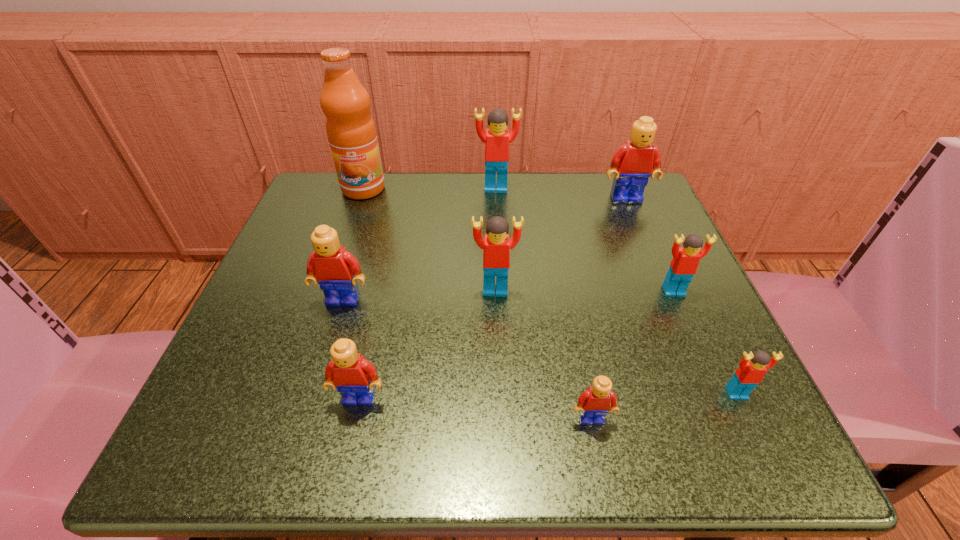
At what (x,y) coordinates should I click in order to perform the action: click on free spot between the tallest object and the smallest red Lego. Please return your answer as a coordinate pair (x, y). This screenshot has height=540, width=960. Looking at the image, I should click on (550, 291).

Where is `free space that is in between the fourth Lego from right to left and the biggest yellow Lego`? The height and width of the screenshot is (540, 960). free space that is in between the fourth Lego from right to left and the biggest yellow Lego is located at coordinates (609, 308).

Locate an element on the screen. Image resolution: width=960 pixels, height=540 pixels. vacant region between the fifth Lego from left to right and the third smallest red Lego is located at coordinates (543, 354).

The image size is (960, 540). In order to click on empty space that is in between the biggest red Lego and the tallest object in this screenshot , I will do `click(430, 188)`.

In order to click on vacant space that is in between the sixth object from left to right and the third farthest yellow Lego in this screenshot , I will do `click(476, 408)`.

Identify the location of vacant point located between the rightmost yellow Lego and the second biggest red Lego. point(561,244).

At what (x,y) coordinates should I click in order to perform the action: click on free spot between the sixth object from left to right and the farthest red Lego. Please return your answer as a coordinate pair (x, y). The height and width of the screenshot is (540, 960). Looking at the image, I should click on (543, 303).

Locate an element on the screen. The image size is (960, 540). free space between the third biggest red Lego and the second smallest yellow Lego is located at coordinates click(x=516, y=345).

Identify which object is the seventh nearest to the third biggest red Lego. Please provide its 2D coordinates. Your answer should be formatted as a tuple, i.e. [(x, y)], where the tuple contains the x and y coordinates of a point satisfying the conditions above.

[(336, 270)]

Image resolution: width=960 pixels, height=540 pixels. In order to click on the eighth closest object to the second smallest red Lego in this screenshot , I will do `click(351, 132)`.